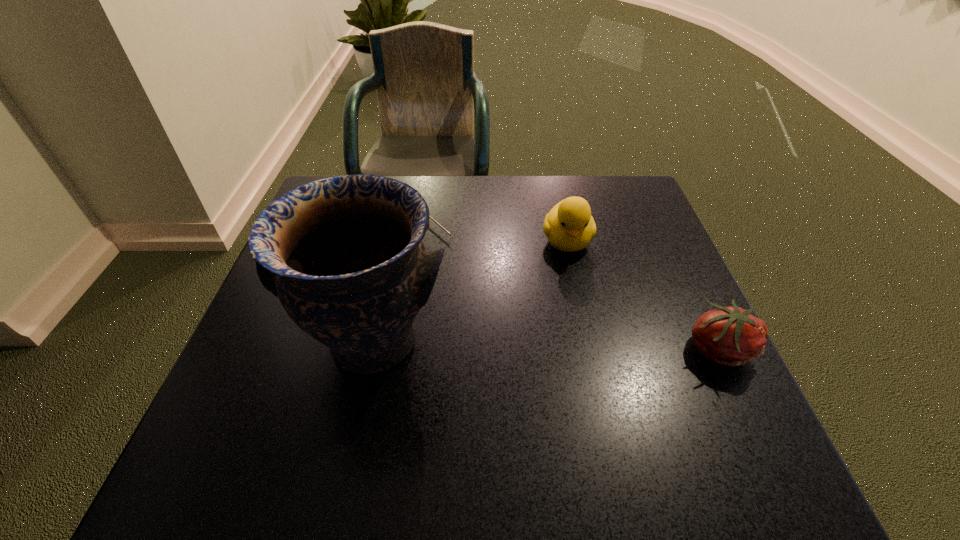
Locate an element on the screen. free space on the desktop that is between the tallest object and the tomato and is positioned insert the screwdriver into a screw head is located at coordinates (568, 345).

The image size is (960, 540). In order to click on vacant spot on the desktop that is between the pottery and the second shortest object and is positioned on the front-facing side of the duck in this screenshot , I will do `click(588, 346)`.